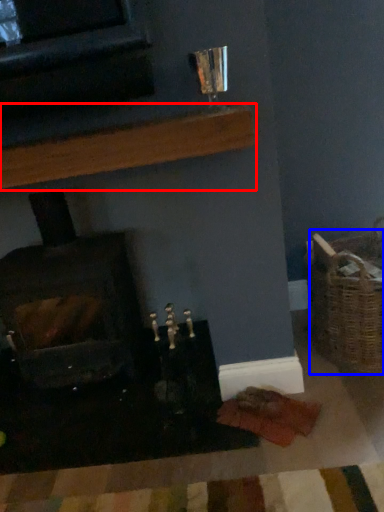
Question: Among these objects, which one is nearest to the camera, shelf (highlighted by a red box) or basket (highlighted by a blue box)?

Choices:
 (A) shelf
 (B) basket

Answer: (A)